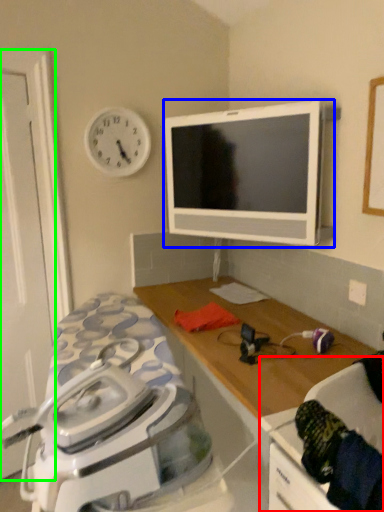
Question: Which object is the farthest from swivel chair (highlighted by a red box)? Choose among these: television (highlighted by a blue box) or door (highlighted by a green box).

Choices:
 (A) television
 (B) door

Answer: (B)